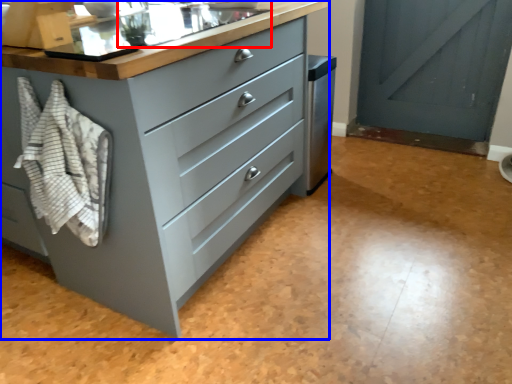
Question: Among these objects, which one is farthest to the camera, sink (highlighted by a red box) or chest of drawers (highlighted by a blue box)?

Choices:
 (A) sink
 (B) chest of drawers

Answer: (A)